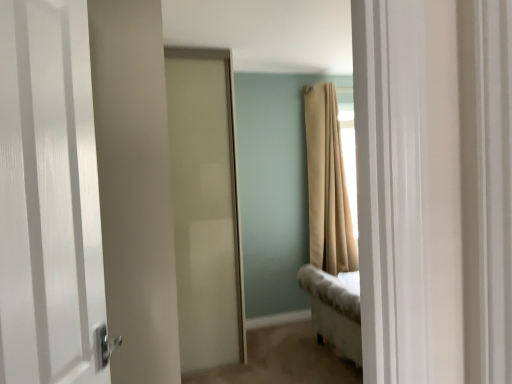
In order to face satin white door at center, the 1th door from the back, should I rotate leftwards or rightwards?

To align with it, rotate left about 7.469°.

What do you see at coordinates (327, 184) in the screenshot?
I see `beige fabric curtain at upper right` at bounding box center [327, 184].

Identify the location of white glossy door at left, positioned as the first door in front-to-back order. Image resolution: width=512 pixels, height=384 pixels. (48, 197).

From the image's perspective, does satin white door at center, placed as the 2th door when sorted from front to back, appear higher than white glossy door at left, positioned as the first door in front-to-back order?

Actually, satin white door at center, placed as the 2th door when sorted from front to back, appears below white glossy door at left, positioned as the first door in front-to-back order, in the image.

From a real-world perspective, which object stands above the other?

white glossy door at left, positioned as the first door in front-to-back order, from a real-world perspective.

Which is correct: white glossy door at left, positioned as the first door in front-to-back order, is inside satin white door at center, placed as the 2th door when sorted from front to back, or outside of it?

white glossy door at left, positioned as the first door in front-to-back order, is spatially situated outside satin white door at center, placed as the 2th door when sorted from front to back.

Considering the relative positions of white glossy door at left, which is counted as the 2th door, starting from the back, and satin white door at center, placed as the 2th door when sorted from front to back, in the image provided, is white glossy door at left, which is counted as the 2th door, starting from the back, to the left or to the right of satin white door at center, placed as the 2th door when sorted from front to back,?

Clearly, white glossy door at left, which is counted as the 2th door, starting from the back, is on the left of satin white door at center, placed as the 2th door when sorted from front to back, in the image.

From the image's perspective, between white glossy door at left, positioned as the first door in front-to-back order, and satin white door at center, placed as the 2th door when sorted from front to back, who is located below?

satin white door at center, placed as the 2th door when sorted from front to back, from the image's perspective.

How much distance is there between beige fabric curtain at upper right and satin white door at center, the 1th door from the back?

beige fabric curtain at upper right and satin white door at center, the 1th door from the back, are 1.18 meters apart.

Is there a large distance between beige fabric curtain at upper right and satin white door at center, placed as the 2th door when sorted from front to back?

Yes, beige fabric curtain at upper right and satin white door at center, placed as the 2th door when sorted from front to back, are located far from each other.

Considering the relative sizes of beige fabric curtain at upper right and satin white door at center, the 1th door from the back, in the image provided, is beige fabric curtain at upper right taller than satin white door at center, the 1th door from the back,?

No.

Is point (315, 100) positioned after point (186, 127)?

Yes, point (315, 100) is behind point (186, 127).

From the image's perspective, between satin white door at center, the 1th door from the back, and beige fabric curtain at upper right, who is located below?

satin white door at center, the 1th door from the back, appears lower in the image.

Which of these two, satin white door at center, placed as the 2th door when sorted from front to back, or beige fabric curtain at upper right, is wider?

Wider between the two is satin white door at center, placed as the 2th door when sorted from front to back.

In the image, is satin white door at center, placed as the 2th door when sorted from front to back, on the left side or the right side of beige fabric curtain at upper right?

satin white door at center, placed as the 2th door when sorted from front to back, is to the left of beige fabric curtain at upper right.

Which is farther from the camera, [186,197] or [342,201]?

The point [342,201] is behind.

Looking at this image, in the image, is white glossy door at left, which is counted as the 2th door, starting from the back, positioned in front of or behind beige fabric curtain at upper right?

Clearly, white glossy door at left, which is counted as the 2th door, starting from the back, is in front of beige fabric curtain at upper right.

Considering the sizes of objects white glossy door at left, positioned as the first door in front-to-back order, and beige fabric curtain at upper right in the image provided, who is wider, white glossy door at left, positioned as the first door in front-to-back order, or beige fabric curtain at upper right?

beige fabric curtain at upper right.

Is white glossy door at left, which is counted as the 2th door, starting from the back, aimed at beige fabric curtain at upper right?

No.

Could you measure the distance between white glossy door at left, positioned as the first door in front-to-back order, and beige fabric curtain at upper right?

white glossy door at left, positioned as the first door in front-to-back order, is 2.99 meters away from beige fabric curtain at upper right.

Considering the relative positions of beige fabric curtain at upper right and white glossy door at left, positioned as the first door in front-to-back order, in the image provided, is beige fabric curtain at upper right to the right of white glossy door at left, positioned as the first door in front-to-back order, from the viewer's perspective?

Indeed, beige fabric curtain at upper right is positioned on the right side of white glossy door at left, positioned as the first door in front-to-back order.

Is beige fabric curtain at upper right positioned far away from white glossy door at left, positioned as the first door in front-to-back order?

beige fabric curtain at upper right is positioned a significant distance from white glossy door at left, positioned as the first door in front-to-back order.

What's the angular difference between beige fabric curtain at upper right and white glossy door at left, which is counted as the 2th door, starting from the back,'s facing directions?

beige fabric curtain at upper right and white glossy door at left, which is counted as the 2th door, starting from the back, are facing 65.6 degrees away from each other.

Between beige fabric curtain at upper right and white glossy door at left, positioned as the first door in front-to-back order, which one has less height?

white glossy door at left, positioned as the first door in front-to-back order.

Locate an element on the screen. This screenshot has height=384, width=512. door on the right of white glossy door at left, which is counted as the 2th door, starting from the back is located at coordinates (205, 209).

This screenshot has height=384, width=512. I want to click on door above the satin white door at center, placed as the 2th door when sorted from front to back (from the image's perspective), so click(48, 197).

When comparing their distances from white glossy door at left, which is counted as the 2th door, starting from the back, does satin white door at center, placed as the 2th door when sorted from front to back, or beige fabric curtain at upper right seem further?

beige fabric curtain at upper right.

Estimate the real-world distances between objects in this image. Which object is closer to satin white door at center, placed as the 2th door when sorted from front to back, beige fabric curtain at upper right or white glossy door at left, which is counted as the 2th door, starting from the back?

The object closer to satin white door at center, placed as the 2th door when sorted from front to back, is beige fabric curtain at upper right.

From the image, which object appears to be farther from beige fabric curtain at upper right, satin white door at center, the 1th door from the back, or white glossy door at left, which is counted as the 2th door, starting from the back?

Among the two, white glossy door at left, which is counted as the 2th door, starting from the back, is located further to beige fabric curtain at upper right.

Based on their spatial positions, is beige fabric curtain at upper right or satin white door at center, placed as the 2th door when sorted from front to back, further from white glossy door at left, positioned as the first door in front-to-back order?

beige fabric curtain at upper right.

From the image, which object appears to be farther from beige fabric curtain at upper right, white glossy door at left, which is counted as the 2th door, starting from the back, or satin white door at center, placed as the 2th door when sorted from front to back?

Among the two, white glossy door at left, which is counted as the 2th door, starting from the back, is located further to beige fabric curtain at upper right.

From the picture: Considering their positions, is white glossy door at left, which is counted as the 2th door, starting from the back, positioned closer to satin white door at center, the 1th door from the back, than beige fabric curtain at upper right?

The object closer to satin white door at center, the 1th door from the back, is beige fabric curtain at upper right.

The image size is (512, 384). In order to click on door located between white glossy door at left, positioned as the first door in front-to-back order, and beige fabric curtain at upper right in the depth direction in this screenshot , I will do `click(205, 209)`.